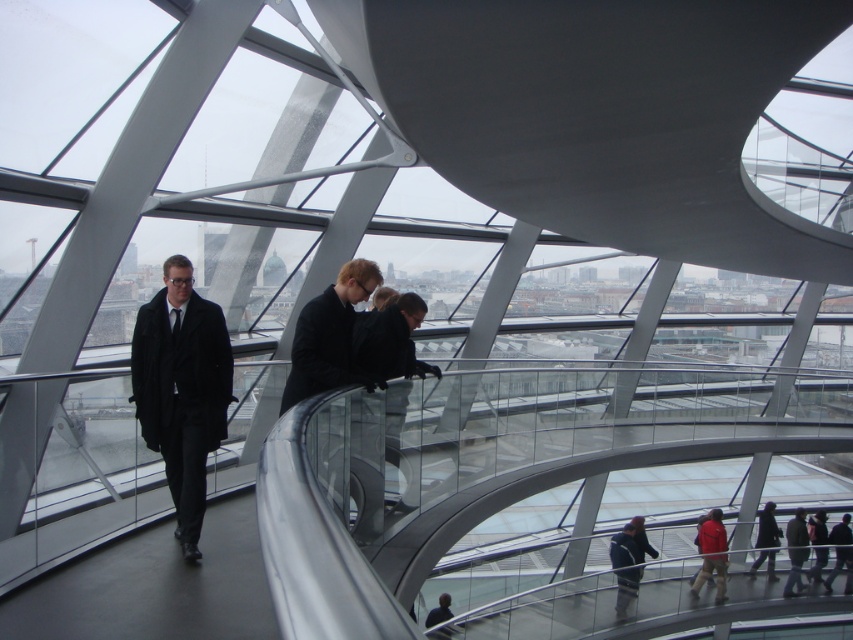
Question: Which of the following is the closest to the observer?

Choices:
 (A) black matte suit at center
 (B) matte black coat at left
 (C) matte black jacket at lower right

Answer: (B)

Question: Is black matte suit at center smaller than matte black jacket at lower right?

Choices:
 (A) yes
 (B) no

Answer: (B)

Question: Which point is farther from the camera taking this photo?

Choices:
 (A) (282, 396)
 (B) (815, 580)

Answer: (B)

Question: Estimate the real-world distances between objects in this image. Which object is farther from the black matte suit at center?

Choices:
 (A) matte black jacket at lower right
 (B) matte black coat at left

Answer: (A)

Question: Can you confirm if matte black coat at left is bigger than matte black jacket at lower right?

Choices:
 (A) no
 (B) yes

Answer: (B)

Question: Is matte black coat at left to the left of matte black jacket at lower right from the viewer's perspective?

Choices:
 (A) no
 (B) yes

Answer: (B)